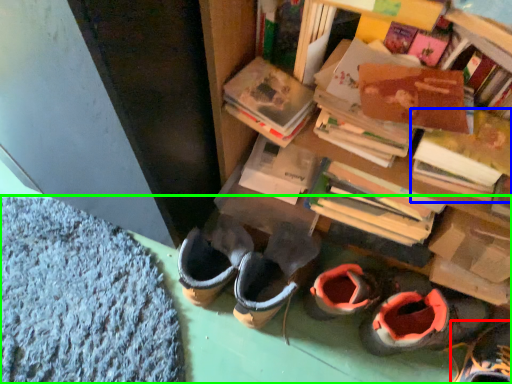
Question: Based on their relative distances, which object is nearer to footwear (highlighted by a red box)? Choose from book (highlighted by a blue box) and carpets (highlighted by a green box).

Choices:
 (A) book
 (B) carpets

Answer: (A)